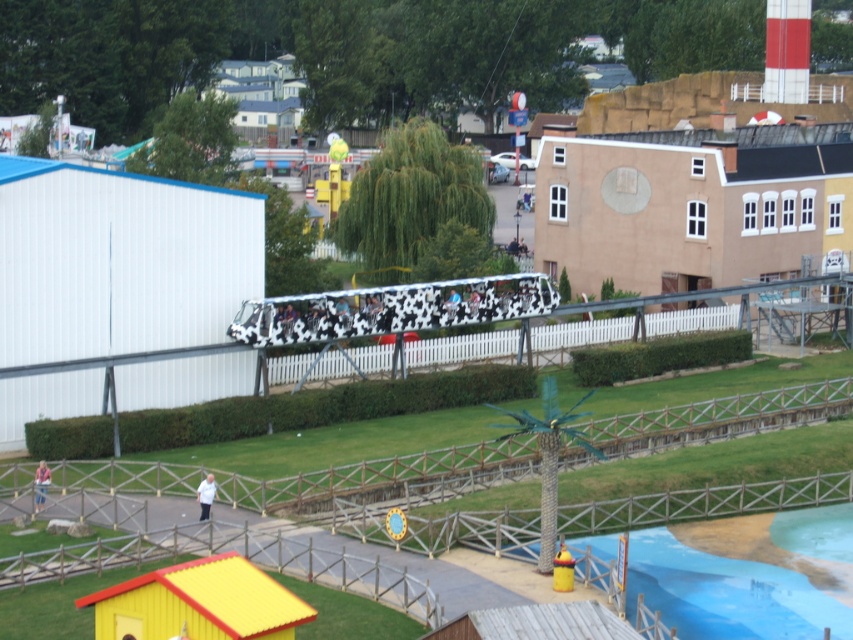
At what (x,y) coordinates should I click in order to perform the action: click on blue smooth pool at lower right. Please return your answer as a coordinate pair (x, y). This screenshot has width=853, height=640. Looking at the image, I should click on (726, 593).

Does blue smooth pool at lower right appear under white fabric shirt at lower center?

Indeed, blue smooth pool at lower right is positioned under white fabric shirt at lower center.

Which is in front, point (680, 604) or point (213, 492)?

Point (680, 604) is in front.

At what (x,y) coordinates should I click in order to perform the action: click on blue smooth pool at lower right. Please return your answer as a coordinate pair (x, y). The width and height of the screenshot is (853, 640). Looking at the image, I should click on (726, 593).

Is blue smooth pool at lower right below light blue denim jeans at lower left?

Yes.

Does blue smooth pool at lower right lie in front of light blue denim jeans at lower left?

Yes, it is.

Is point (775, 524) positioned behind point (39, 467)?

No, (775, 524) is closer to viewer.

Where is `blue smooth pool at lower right`? This screenshot has height=640, width=853. blue smooth pool at lower right is located at coordinates (726, 593).

Between light blue denim jeans at lower left and white fabric shirt at lower center, which one is positioned lower?

white fabric shirt at lower center is below.

Measure the distance between light blue denim jeans at lower left and camera.

light blue denim jeans at lower left and camera are 50.02 meters apart from each other.

The height and width of the screenshot is (640, 853). I want to click on light blue denim jeans at lower left, so click(x=39, y=484).